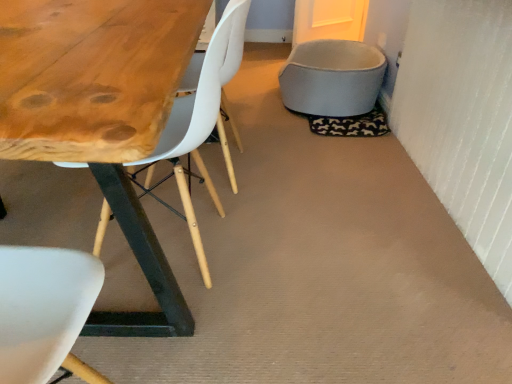
What do you see at coordinates (332, 78) in the screenshot? I see `soft fabric pet bed at upper right` at bounding box center [332, 78].

This screenshot has height=384, width=512. Identify the location of soft fabric pet bed at upper right. (332, 78).

Based on the photo, is white plastic chair at upper left bigger or smaller than soft fabric pet bed at upper right?

white plastic chair at upper left is bigger than soft fabric pet bed at upper right.

Does point (218, 111) come farther from viewer compared to point (335, 106)?

No, (218, 111) is in front of (335, 106).

From the image's perspective, which one is positioned lower, white plastic chair at upper left or soft fabric pet bed at upper right?

From the image's view, white plastic chair at upper left is below.

The height and width of the screenshot is (384, 512). Find the location of `gray that is on the right side of white plastic chair at upper left`. gray that is on the right side of white plastic chair at upper left is located at coordinates (332, 78).

Is white matte chair at center aimed at soft fabric pet bed at upper right?

No.

Can you confirm if white matte chair at center is shorter than soft fabric pet bed at upper right?

Incorrect, the height of white matte chair at center does not fall short of that of soft fabric pet bed at upper right.

Is white matte chair at center smaller than soft fabric pet bed at upper right?

Indeed, white matte chair at center has a smaller size compared to soft fabric pet bed at upper right.

Locate an element on the screen. gray behind the white matte chair at center is located at coordinates (332, 78).

Does point (320, 98) appear closer or farther from the camera than point (177, 98)?

Point (320, 98).

Is soft fabric pet bed at upper right facing towards white plastic chair at upper left?

No.

Is soft fabric pet bed at upper right closer to the viewer compared to white plastic chair at upper left?

No.

How different are the orientations of soft fabric pet bed at upper right and white plastic chair at upper left in degrees?

The facing directions of soft fabric pet bed at upper right and white plastic chair at upper left are 176 degrees apart.

Can you confirm if soft fabric pet bed at upper right is positioned to the right of white matte chair at center?

Yes.

Can you confirm if soft fabric pet bed at upper right is wider than white matte chair at center?

Indeed, soft fabric pet bed at upper right has a greater width compared to white matte chair at center.

Is the surface of soft fabric pet bed at upper right in direct contact with white matte chair at center?

No, soft fabric pet bed at upper right is not with white matte chair at center.

Does point (234, 70) lie in front of point (170, 158)?

Yes.

Does white matte chair at center have a lesser height compared to white plastic chair at upper left?

Indeed, white matte chair at center has a lesser height compared to white plastic chair at upper left.

Does white matte chair at center have a greater width compared to white plastic chair at upper left?

No, white matte chair at center is not wider than white plastic chair at upper left.

Is white matte chair at center further to the viewer compared to white plastic chair at upper left?

Yes, it is behind white plastic chair at upper left.

From the image's perspective, is white plastic chair at upper left under white matte chair at center?

Yes.

Is white matte chair at center surrounded by white plastic chair at upper left?

Actually, white matte chair at center is outside white plastic chair at upper left.

Is white plastic chair at upper left wider than white matte chair at center?

Yes.

I want to click on gray above the white plastic chair at upper left (from the image's perspective), so click(332, 78).

Locate an element on the screen. The image size is (512, 384). armchair to the left of soft fabric pet bed at upper right is located at coordinates (233, 40).

From the image, which object appears to be farther from soft fabric pet bed at upper right, white plastic chair at upper left or white matte chair at center?

white plastic chair at upper left lies further to soft fabric pet bed at upper right than the other object.

Estimate the real-world distances between objects in this image. Which object is closer to white plastic chair at upper left, soft fabric pet bed at upper right or white matte chair at center?

white matte chair at center.

Consider the image. Looking at the image, which one is located further to white plastic chair at upper left, white matte chair at center or soft fabric pet bed at upper right?

soft fabric pet bed at upper right is further to white plastic chair at upper left.

Based on their spatial positions, is white matte chair at center or white plastic chair at upper left closer to soft fabric pet bed at upper right?

white matte chair at center lies closer to soft fabric pet bed at upper right than the other object.

Considering their positions, is soft fabric pet bed at upper right positioned closer to white matte chair at center than white plastic chair at upper left?

white plastic chair at upper left is closer to white matte chair at center.

Which object lies further to the anchor point white matte chair at center, white plastic chair at upper left or soft fabric pet bed at upper right?

soft fabric pet bed at upper right lies further to white matte chair at center than the other object.

Locate an element on the screen. The width and height of the screenshot is (512, 384). armchair between white plastic chair at upper left and soft fabric pet bed at upper right from front to back is located at coordinates (233, 40).